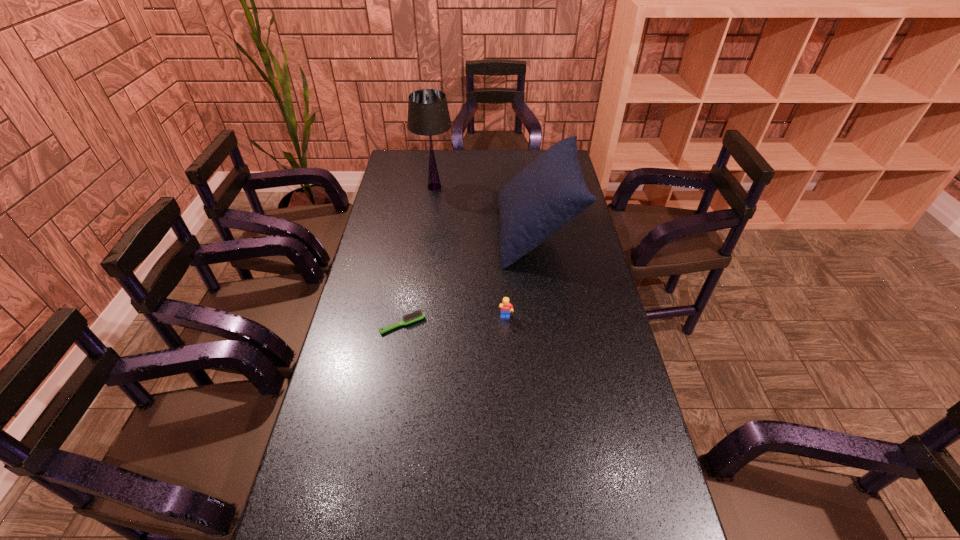
This screenshot has width=960, height=540. Identify the location of vacant space situated on the face of the third tallest object. (507, 338).

The height and width of the screenshot is (540, 960). Find the location of `blank space located 0.180m on the front of the shortest object`. blank space located 0.180m on the front of the shortest object is located at coordinates (392, 387).

Find the location of `lampshade at the left edge`. lampshade at the left edge is located at coordinates (428, 114).

Identify the location of hairbrush present at the left edge. The width and height of the screenshot is (960, 540). (418, 315).

Locate an element on the screen. The width and height of the screenshot is (960, 540). object located in the right edge section of the desktop is located at coordinates (550, 192).

This screenshot has height=540, width=960. I want to click on free space at the far edge, so click(x=531, y=163).

Where is `blank space at the left edge of the desktop`? blank space at the left edge of the desktop is located at coordinates (415, 202).

Locate an element on the screen. The image size is (960, 540). free space at the right edge of the desktop is located at coordinates (585, 286).

Locate an element on the screen. The image size is (960, 540). free point at the far left corner is located at coordinates (415, 167).

Where is `vacant area that lies between the shortest object and the cushion`? vacant area that lies between the shortest object and the cushion is located at coordinates (469, 279).